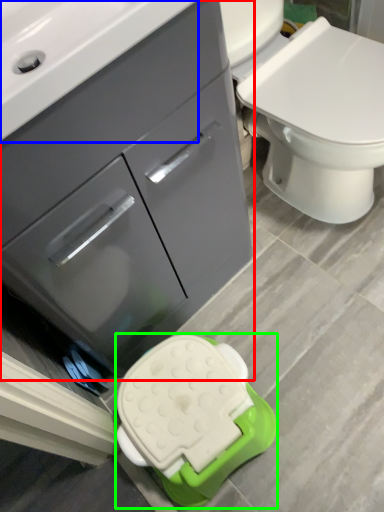
Question: Which object is positioned farthest from bathroom cabinet (highlighted by a red box)? Select from sink (highlighted by a blue box) and porcelain (highlighted by a green box).

Choices:
 (A) sink
 (B) porcelain

Answer: (B)